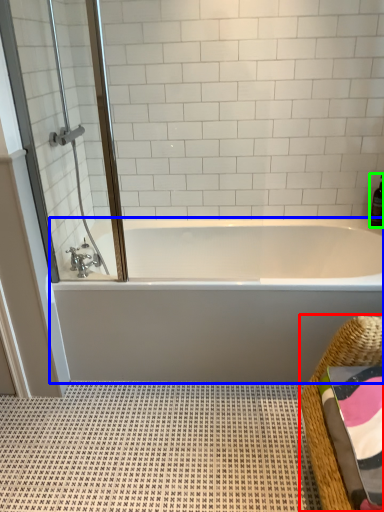
Question: Which object is the closest to the basket (highlighted by a red box)? Choose among these: bathtub (highlighted by a blue box) or bottle (highlighted by a green box).

Choices:
 (A) bathtub
 (B) bottle

Answer: (A)